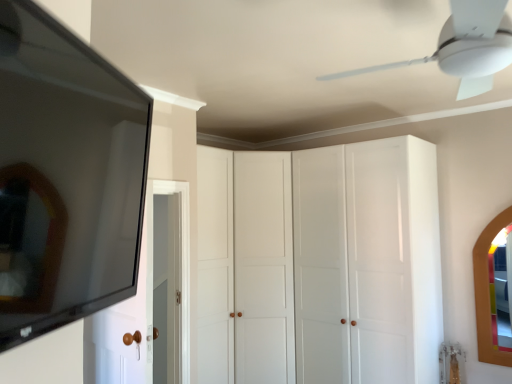
Question: Is wooden-framed mirror at right, positioned as the 2th mirror in left-to-right order, a part of white plastic ceiling fan at upper center?

Choices:
 (A) yes
 (B) no

Answer: (B)

Question: Is the surface of white plastic ceiling fan at upper center in direct contact with wooden-framed mirror at right, which appears as the second mirror when viewed from the top?

Choices:
 (A) yes
 (B) no

Answer: (B)

Question: Does white plastic ceiling fan at upper center come in front of wooden-framed mirror at right, the 2th mirror viewed from the front?

Choices:
 (A) no
 (B) yes

Answer: (B)

Question: From the image's perspective, would you say white plastic ceiling fan at upper center is shown under wooden-framed mirror at right, the first mirror positioned from the back?

Choices:
 (A) no
 (B) yes

Answer: (A)

Question: Does white plastic ceiling fan at upper center have a lesser height compared to wooden-framed mirror at right, which is the first mirror in bottom-to-top order?

Choices:
 (A) no
 (B) yes

Answer: (B)

Question: Do you think white wood door at left is within white glossy cabinet at center, or outside of it?

Choices:
 (A) inside
 (B) outside

Answer: (B)

Question: Is white wood door at left in front of or behind white glossy cabinet at center in the image?

Choices:
 (A) front
 (B) behind

Answer: (A)

Question: From the image's perspective, is white wood door at left above or below white glossy cabinet at center?

Choices:
 (A) below
 (B) above

Answer: (B)

Question: From a real-world perspective, is white wood door at left positioned above or below white glossy cabinet at center?

Choices:
 (A) above
 (B) below

Answer: (A)

Question: Is wooden-framed mirror at right, marked as the first mirror in a right-to-left arrangement, in front of or behind matte black mirror at left, the second mirror from the right, in the image?

Choices:
 (A) behind
 (B) front

Answer: (A)

Question: Is wooden-framed mirror at right, which appears as the second mirror when viewed from the top, wider or thinner than matte black mirror at left, the second mirror from the right?

Choices:
 (A) wide
 (B) thin

Answer: (B)

Question: From a real-world perspective, relative to matte black mirror at left, which ranks as the first mirror in top-to-bottom order, is wooden-framed mirror at right, which is the first mirror in bottom-to-top order, vertically above or below?

Choices:
 (A) above
 (B) below

Answer: (B)

Question: In terms of height, does wooden-framed mirror at right, the 2th mirror viewed from the front, look taller or shorter compared to matte black mirror at left, acting as the first mirror starting from the left?

Choices:
 (A) tall
 (B) short

Answer: (A)

Question: Relative to white wood door at left, is white glossy cabinet at center in front or behind?

Choices:
 (A) behind
 (B) front

Answer: (A)

Question: From the image's perspective, is white glossy cabinet at center above or below white wood door at left?

Choices:
 (A) above
 (B) below

Answer: (B)